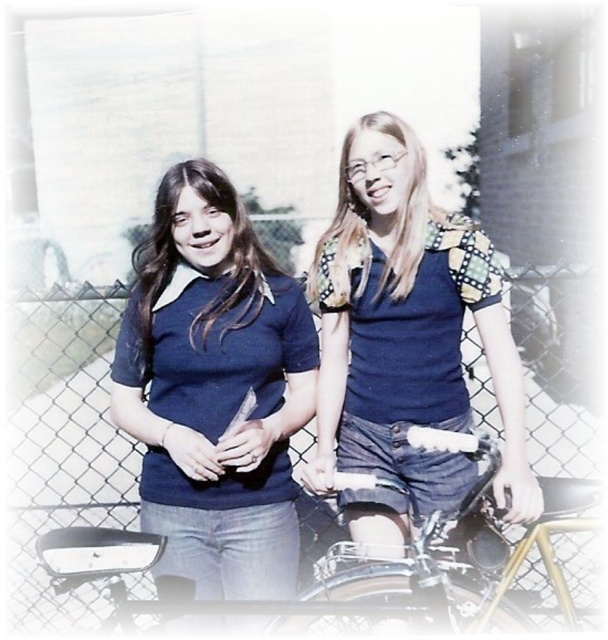
Is the position of matte blue sweater at center more distant than that of blue denim shorts at center?

Yes, matte blue sweater at center is further from the viewer.

Between point (291, 470) and point (513, 390), which one is positioned behind?

Positioned behind is point (291, 470).

Where is `matte blue sweater at center`? matte blue sweater at center is located at coordinates (215, 390).

Is point (356, 317) closer to viewer compared to point (260, 300)?

No.

Is point (393, 380) farther from viewer compared to point (229, 253)?

Yes, it is.

Between point (457, 323) and point (209, 170), which one is positioned in front?

Positioned in front is point (209, 170).

You are a GUI agent. You are given a task and a screenshot of the screen. Output one action in this format:
    pyautogui.click(x=<x>, y=<y>)
    Task: Click on the blue denim shorts at center
    This screenshot has height=640, width=608.
    Given the screenshot: What is the action you would take?
    pyautogui.click(x=406, y=316)

Which of these two, metallic chain-link fence at center or blue denim shorts at center, stands taller?

With more height is metallic chain-link fence at center.

Looking at this image, is metallic chain-link fence at center thinner than blue denim shorts at center?

In fact, metallic chain-link fence at center might be wider than blue denim shorts at center.

Image resolution: width=608 pixels, height=640 pixels. I want to click on metallic chain-link fence at center, so click(63, 445).

Where is `metallic chain-link fence at center`? The height and width of the screenshot is (640, 608). metallic chain-link fence at center is located at coordinates click(x=63, y=445).